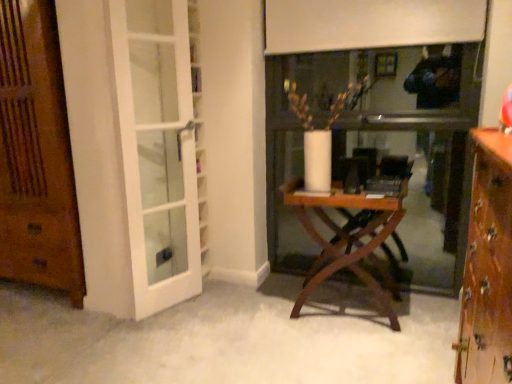
You are a GUI agent. You are given a task and a screenshot of the screen. Output one action in this format:
    pyautogui.click(x=<x>, y=<y>)
    Task: Click on the vacant space positioned to the left of wooden folding table at center
    The image size is (512, 384).
    Given the screenshot: What is the action you would take?
    pyautogui.click(x=250, y=313)